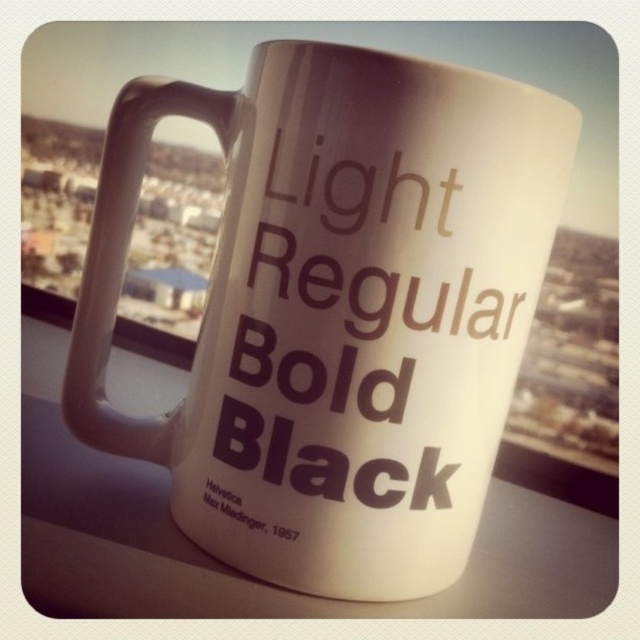
You are designing a logo for a new coffee brand and want to ensure the text is prominent on the white matte mug at center. Given that the bold matte text at center is smaller than the mug, will the text be easily readable from a distance?

The bold matte text at center is smaller than the white matte mug at center, so it may not be easily readable from a distance. Consider increasing the text size or using a contrasting color for better visibility.

You are designing a packaging label for the white matte mug at center and need to ensure there is enough space between the mug and the bold matte text at center. According to the design guidelines, the minimum required spacing between any object and text is 1.5 inches. Is the current spacing sufficient?

The white matte mug at center is 1.22 inches away from the bold matte text at center. Since the required minimum spacing is 1.5 inches, the current spacing of 1.22 inches is insufficient to meet the design guidelines.

You are designing a label for a product that needs to have two sections of text. The first section should be bold and centered, and the second section should be smaller and placed lower left. The total space between them must not exceed 7 inches. Based on the image provided, will the spacing between the bold matte text at center and the black matte text at lower left meet this requirement?

The bold matte text at center and black matte text at lower left are 6.65 inches apart from each other, which is within the 7 inches requirement. Therefore, the spacing meets the requirement.